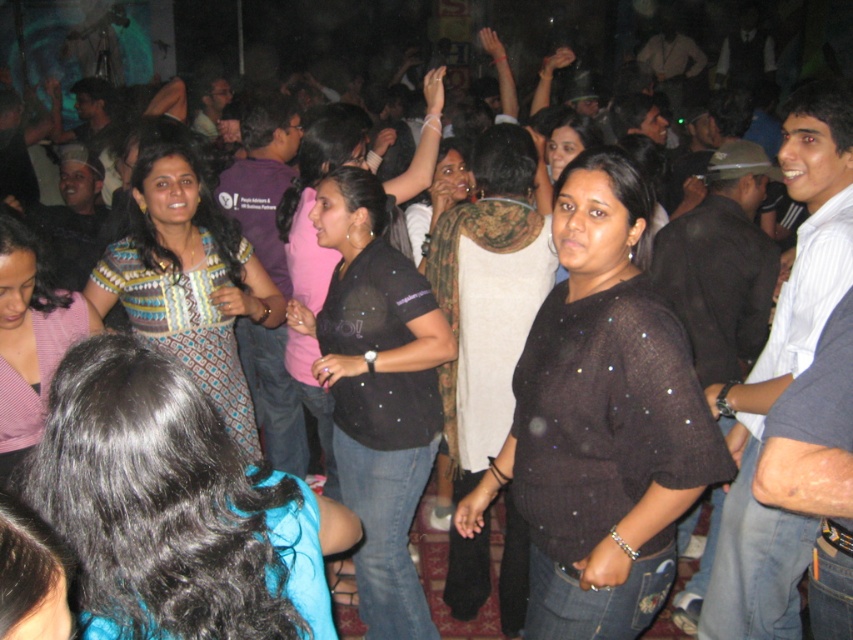
You are a photographer at the party and want to take a closeup photo of the black glittery shirt at center. Your camera has a minimum focusing distance of 2 meters. Can you take the photo without moving closer?

The black glittery shirt at center and viewer are 2.38 meters apart from each other. Since the minimum focusing distance is 2 meters, the photographer can take the closeup photo without moving closer because the distance is sufficient.

You are a photographer at the party and want to capture both the black glittery shirt at center and the patterned fabric blouse at left in a single photo. Which of the two shirts should you adjust the camera focus to prioritize if you want the taller one to be in focus?

The black glittery shirt at center is much taller than the patterned fabric blouse at left, so you should prioritize focusing on the black glittery shirt at center to ensure it is in focus.

You are a photographer at this event and want to capture both the black glittery shirt at center and the patterned fabric dress at center in a single photo. Which object should you focus on first to ensure both are in frame?

The black glittery shirt at center is much taller than the patterned fabric dress at center, so you should focus on the black glittery shirt at center first to ensure both are in frame.